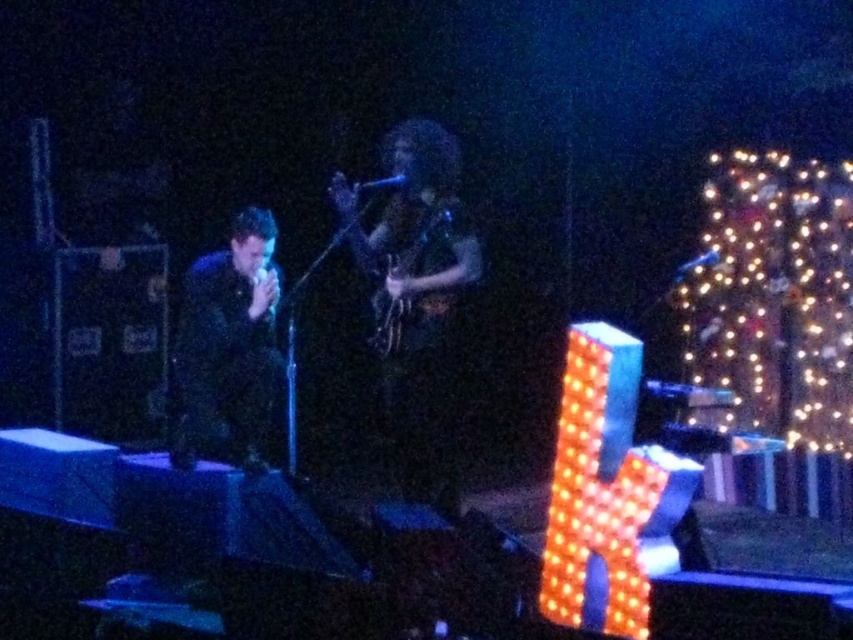
The height and width of the screenshot is (640, 853). Describe the element at coordinates (415, 296) in the screenshot. I see `shiny black guitar at center` at that location.

Who is positioned more to the left, shiny black guitar at center or black matte suit at left?

black matte suit at left is more to the left.

Is point (370, 244) less distant than point (222, 280)?

Yes, point (370, 244) is in front of point (222, 280).

Where is `shiny black guitar at center`? This screenshot has height=640, width=853. shiny black guitar at center is located at coordinates (415, 296).